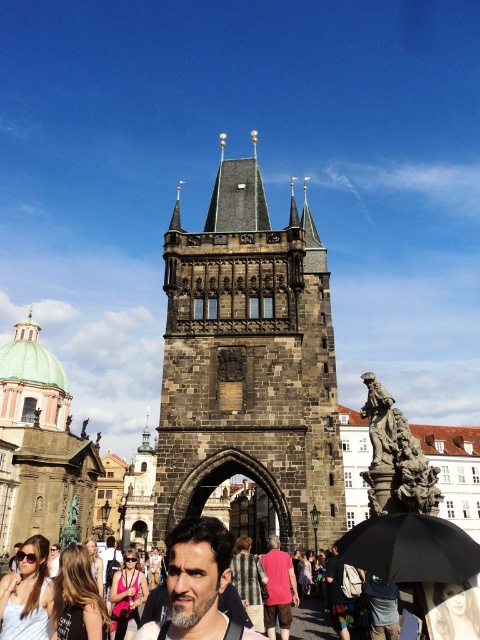
From the picture: You are standing in the historic city square and want to take a photo of the Gothic tower. There are two points marked in the scene. The first point is at coordinates point [17,552] and the second point is at point [252,580]. Which point is closer to you, the observer?

Point [17,552] is in front of point [252,580], so the first point is closer to you.

Looking at this image, you are a photographer standing in the city square and want to take a photo that includes both the blonde hair at lower left and the red cotton shirt at center. Based on their heights, which object should be placed closer to the front of the photo to ensure both are visible?

The blonde hair at lower left is shorter than the red cotton shirt at center. To ensure both are visible in the photo, position the blonde hair at lower left closer to the front so its shorter height doesn